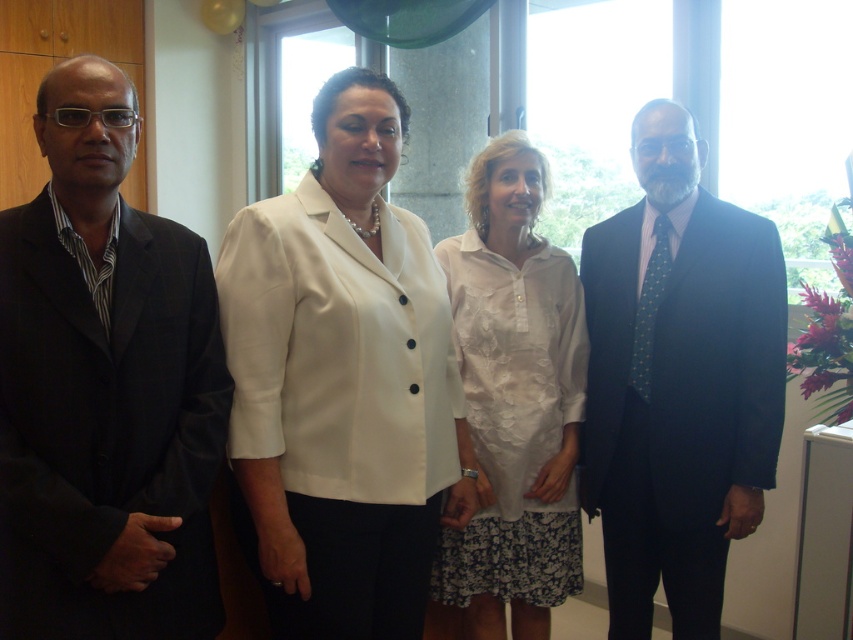
Is white matte blazer at center taller than dark blue suit at right?

Incorrect, white matte blazer at center's height is not larger of dark blue suit at right's.

Looking at this image, is white matte blazer at center positioned before dark blue suit at right?

That is True.

This screenshot has height=640, width=853. I want to click on white matte blazer at center, so (x=341, y=381).

Where is `white matte blazer at center`? white matte blazer at center is located at coordinates point(341,381).

Which is below, matte black suit at left or white matte blazer at center?

white matte blazer at center is lower down.

Based on the photo, does matte black suit at left have a lesser height compared to white matte blazer at center?

Yes, matte black suit at left is shorter than white matte blazer at center.

The width and height of the screenshot is (853, 640). I want to click on matte black suit at left, so click(x=103, y=388).

At what (x,y) coordinates should I click in order to perform the action: click on matte black suit at left. Please return your answer as a coordinate pair (x, y). The height and width of the screenshot is (640, 853). Looking at the image, I should click on (103, 388).

Is point (163, 268) behind point (605, 461)?

No, (163, 268) is in front of (605, 461).

Who is higher up, matte black suit at left or dark blue suit at right?

Positioned higher is matte black suit at left.

Image resolution: width=853 pixels, height=640 pixels. What do you see at coordinates (103, 388) in the screenshot?
I see `matte black suit at left` at bounding box center [103, 388].

This screenshot has width=853, height=640. I want to click on matte black suit at left, so click(103, 388).